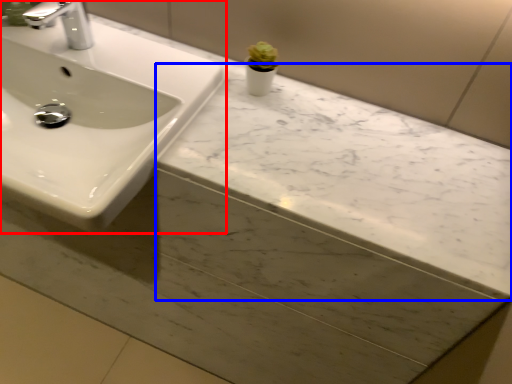
Question: Which object appears closest to the camera in this image, sink (highlighted by a red box) or counter top (highlighted by a blue box)?

Choices:
 (A) sink
 (B) counter top

Answer: (A)